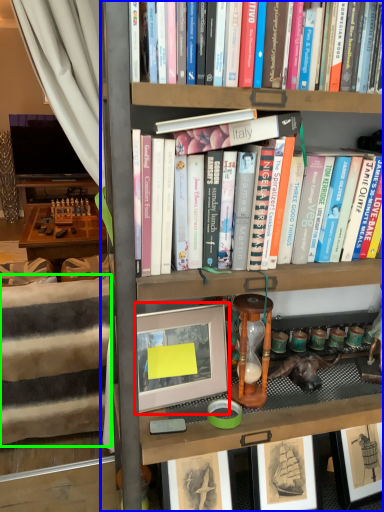
Question: Considering the real-world distances, which object is farthest from picture frame (highlighted by a red box)? bookcase (highlighted by a blue box) or bed frame (highlighted by a green box)?

Choices:
 (A) bookcase
 (B) bed frame

Answer: (B)